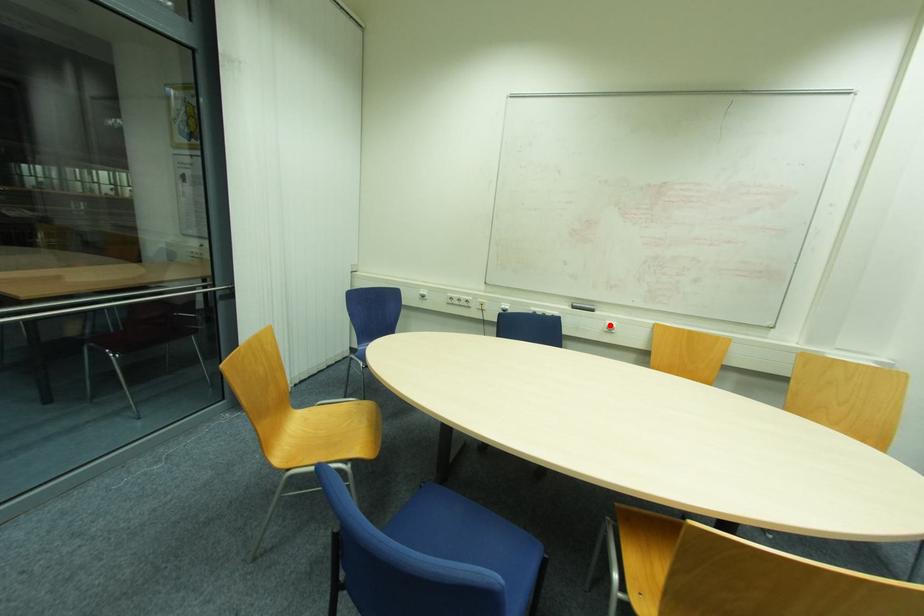
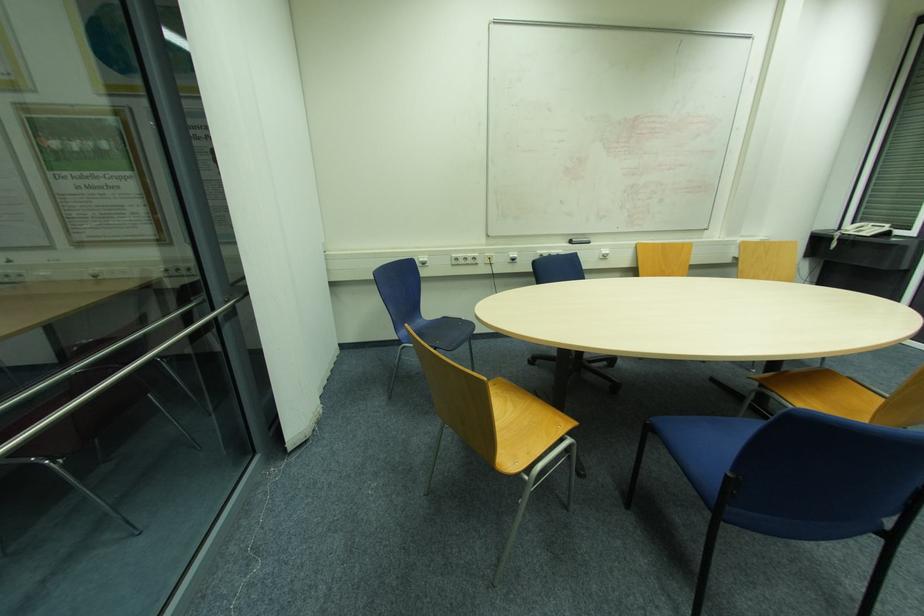
Find the pixel in the second image that matches the highlighted location in the first image.

(604, 253)